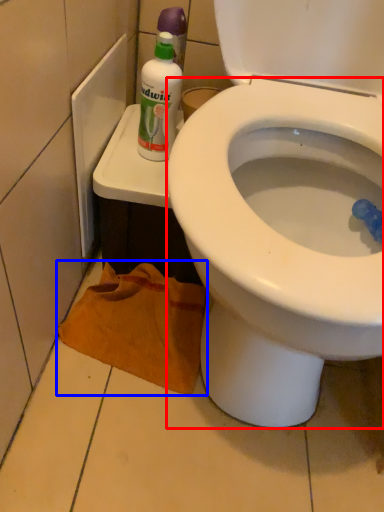
Question: Which of the following is the closest to the observer, bidet (highlighted by a red box) or material (highlighted by a blue box)?

Choices:
 (A) bidet
 (B) material

Answer: (A)